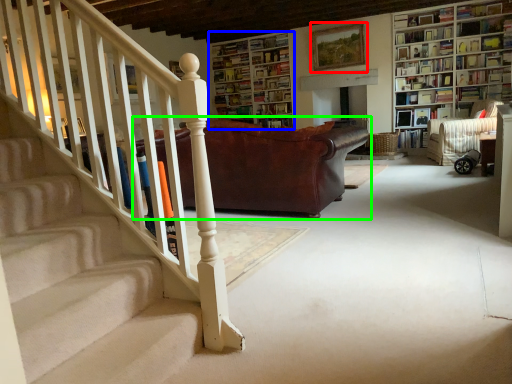
Question: Based on their relative distances, which object is nearer to picture frame (highlighted by a red box)? Choose from bookcase (highlighted by a blue box) and studio couch (highlighted by a green box).

Choices:
 (A) bookcase
 (B) studio couch

Answer: (A)